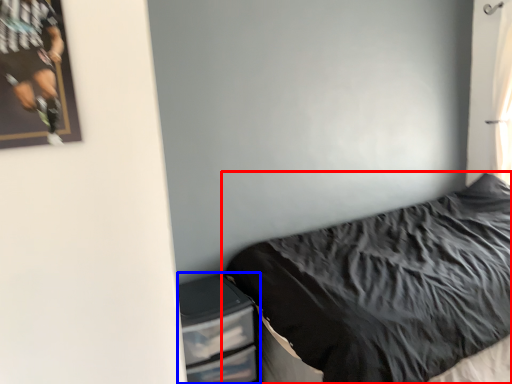
Question: Which of the following is the closest to the observer, bed (highlighted by a red box) or dresser (highlighted by a blue box)?

Choices:
 (A) bed
 (B) dresser

Answer: (A)